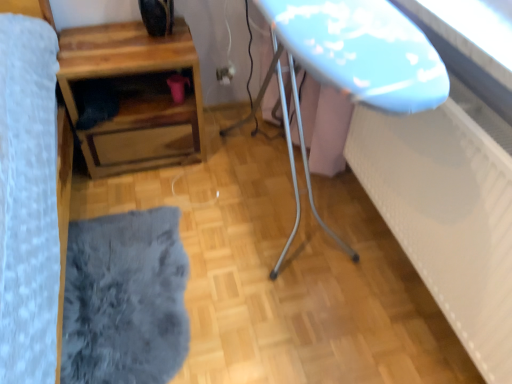
You are a GUI agent. You are given a task and a screenshot of the screen. Output one action in this format:
    pyautogui.click(x=<x>, y=<y>)
    Task: Click on the vacant space behind fuzzy gray rug at lower left
    The width and height of the screenshot is (512, 384).
    Given the screenshot: What is the action you would take?
    pyautogui.click(x=185, y=192)